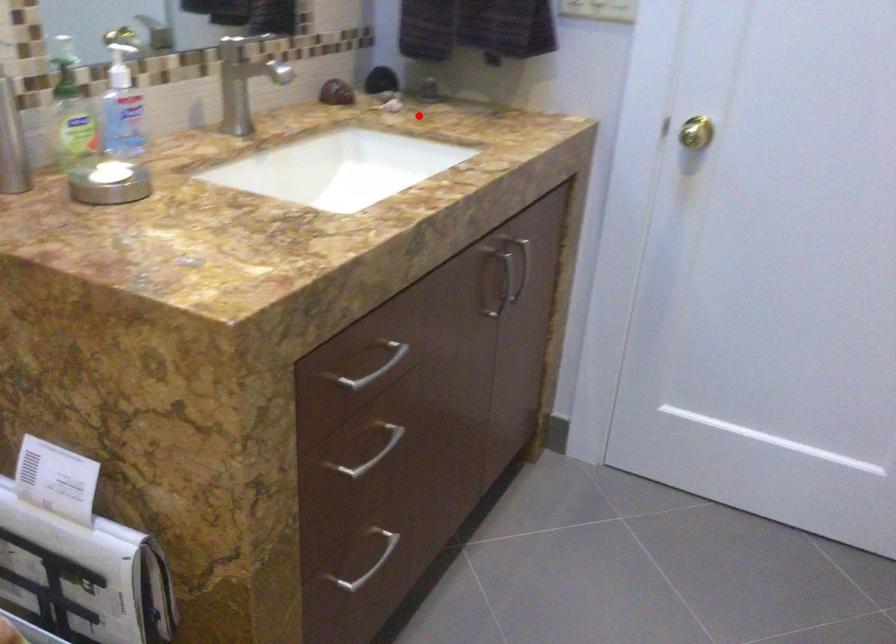
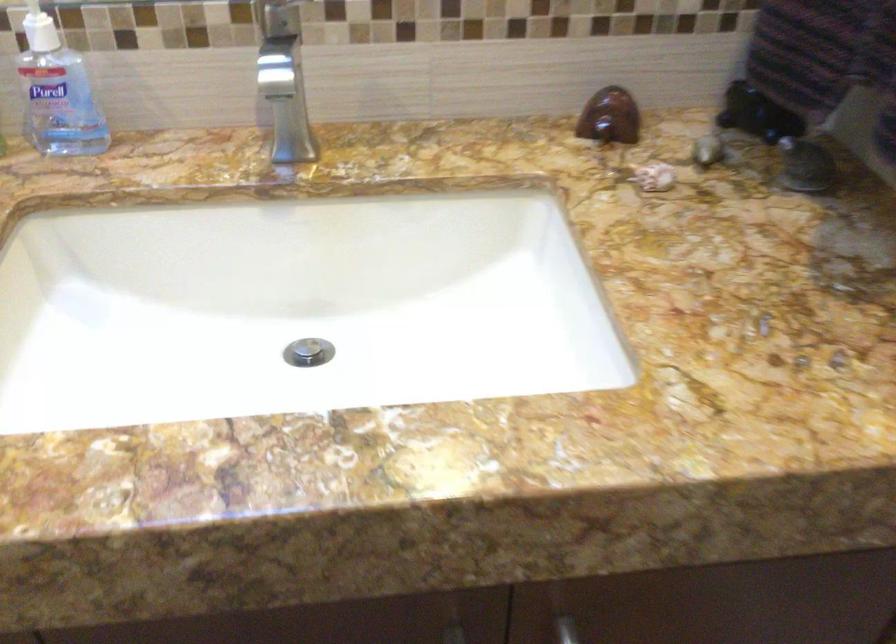
Question: I am providing you with two images of the same scene from different viewpoints. Given a red point in image1, look at the same physical point in image2. Is it:

Choices:
 (A) Closer to the viewpoint
 (B) Farther from the viewpoint

Answer: (A)